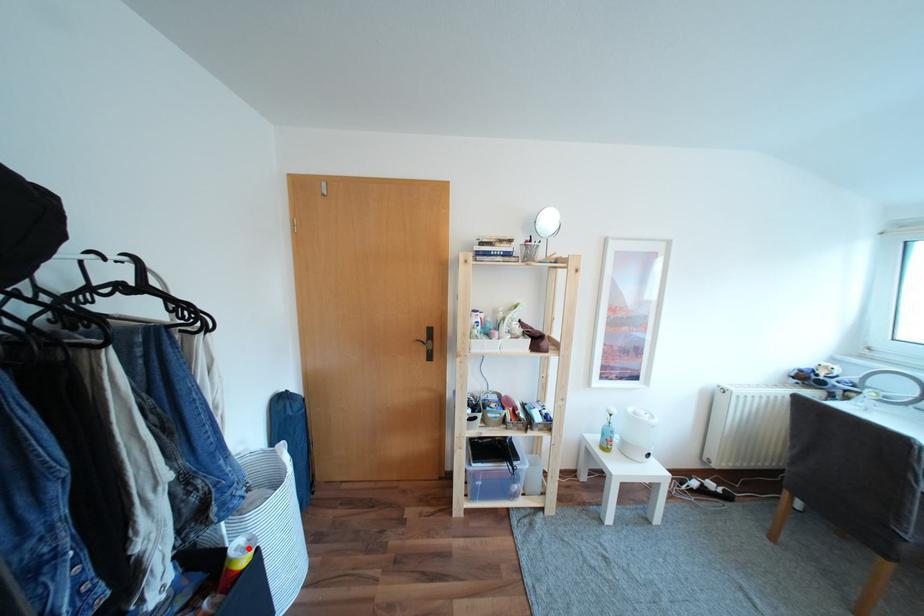
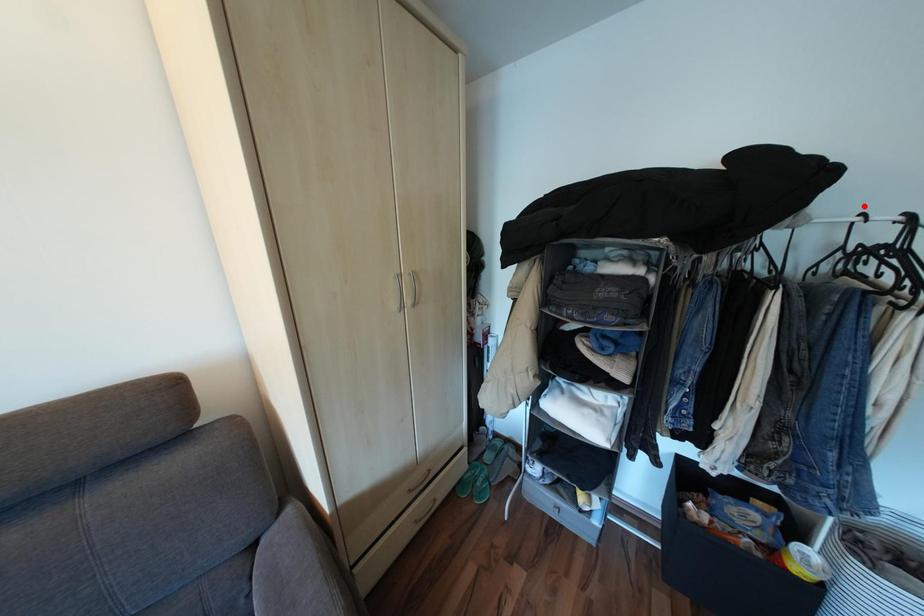
I am providing you with two images of the same scene from different viewpoints. A red point is marked on the first image and another point is marked on the second image. Are the points marked in image1 and image2 representing the same 3D position?

No